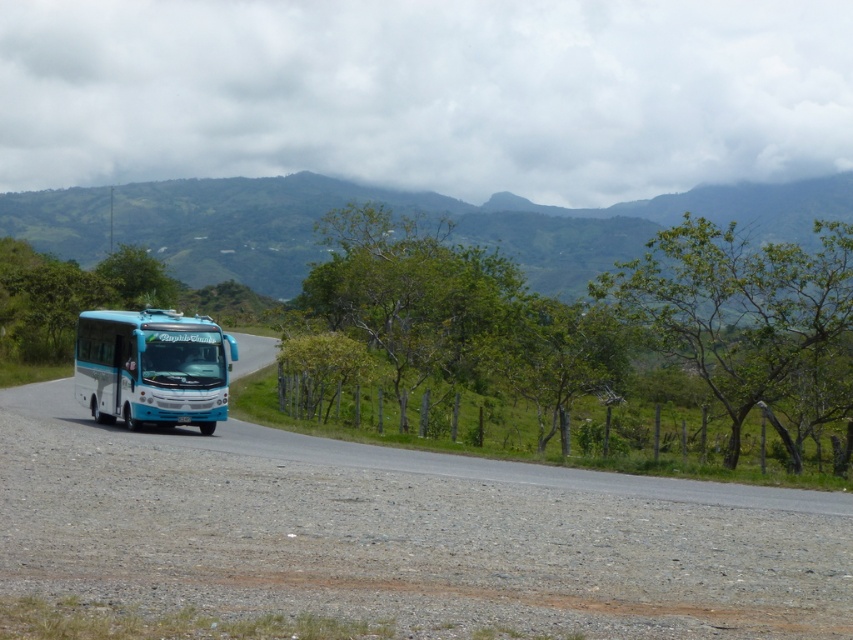
You are standing at the center of the road in the rural scene. Looking towards the green leafy mountain at upper center, which direction should you face to see it clearly?

The green leafy mountain at upper center is located at point (436, 218), so you should face towards the upper center direction to see it clearly.

You are a driver approaching the teal glossy bus at left on a rural road. You notice a green leafy mountain at upper center in the distance. Based on their sizes in the image, which object appears closer to you?

The teal glossy bus at left appears closer to you because it is smaller in size compared to the green leafy mountain at upper center, which is larger and likely farther away.

You are a passenger on the teal glossy bus at left and you look out the window. Which direction should you turn your head to see the green leafy mountain at upper center?

The green leafy mountain at upper center is positioned on the right side of the teal glossy bus at left, so you should turn your head to the right to see it.